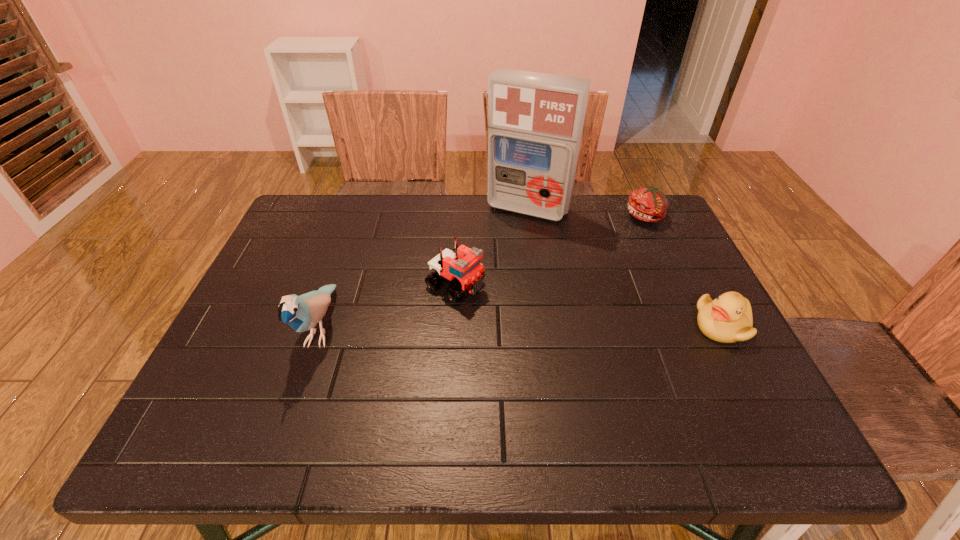
What are the coordinates of `bird` in the screenshot? It's located at (302, 313).

Find the location of a particular element. The height and width of the screenshot is (540, 960). the leftmost object is located at coordinates (302, 313).

In order to click on duckling in this screenshot , I will do pyautogui.click(x=727, y=319).

What are the coordinates of `tomato` in the screenshot? It's located at click(648, 204).

At what (x,y) coordinates should I click in order to perform the action: click on the second object from left to right. Please return your answer as a coordinate pair (x, y). Looking at the image, I should click on (461, 267).

Identify the location of the third shortest object. (461, 267).

At what (x,y) coordinates should I click in order to perform the action: click on the third object from right to left. Please return your answer as a coordinate pair (x, y). The image size is (960, 540). Looking at the image, I should click on (535, 120).

Where is `the tallest object`? This screenshot has width=960, height=540. the tallest object is located at coordinates (535, 120).

Identify the location of vacant point located on the beak of the duckling. The height and width of the screenshot is (540, 960). (652, 326).

Where is `free location located on the beak of the duckling`? This screenshot has height=540, width=960. free location located on the beak of the duckling is located at coordinates (558, 326).